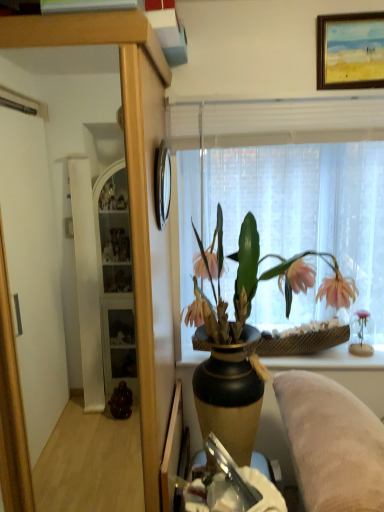
What are the coordinates of `matte black vase with pink flowers at center` in the screenshot? It's located at (244, 336).

In order to face wooden clock at upper center, which is counted as the 2th picture frame, starting from the right, should I rotate leftwards or rightwards?

A 3.665 degree turn to the left will do.

What do you see at coordinates (302, 342) in the screenshot? The image size is (384, 512). I see `woven brown basket at right` at bounding box center [302, 342].

I want to click on matte black vase with pink flowers at center, so click(244, 336).

Does point (225, 153) come behind point (261, 345)?

No, (225, 153) is closer to viewer.

Does translucent fabric at upper center come behind woven brown basket at right?

No, translucent fabric at upper center is closer to the viewer.

Considering the sizes of objects translucent fabric at upper center and woven brown basket at right in the image provided, who is thinner, translucent fabric at upper center or woven brown basket at right?

Thinner between the two is translucent fabric at upper center.

Is woven brown basket at right at the back of translucent fabric at upper center?

No, translucent fabric at upper center's orientation is not away from woven brown basket at right.

From a real-world perspective, is matte black vase with pink flowers at center above or below wooden cabinet at center?

Clearly, from a real-world perspective, matte black vase with pink flowers at center is above wooden cabinet at center.

Is matte black vase with pink flowers at center closer to the viewer compared to wooden cabinet at center?

No, matte black vase with pink flowers at center is behind wooden cabinet at center.

Considering the sizes of objects matte black vase with pink flowers at center and wooden cabinet at center in the image provided, who is shorter, matte black vase with pink flowers at center or wooden cabinet at center?

Standing shorter between the two is matte black vase with pink flowers at center.

Which point is more forward, (210, 415) or (147, 473)?

The point (210, 415) is closer to the camera.

The image size is (384, 512). Identify the location of basket that appears below the translucent fabric at upper center (from a real-world perspective). [302, 342].

Based on the photo, from a real-world perspective, is woven brown basket at right beneath translucent fabric at upper center?

Correct, in the physical world, woven brown basket at right is lower than translucent fabric at upper center.

Looking at the image, does woven brown basket at right seem bigger or smaller compared to translucent fabric at upper center?

Clearly, woven brown basket at right is smaller in size than translucent fabric at upper center.

Does translucent fabric at upper center have a larger size compared to wooden cabinet at center?

No, translucent fabric at upper center is not bigger than wooden cabinet at center.

Is translucent fabric at upper center closer to camera compared to wooden cabinet at center?

No, translucent fabric at upper center is further to the viewer.

From a real-world perspective, is translucent fabric at upper center on wooden cabinet at center?

Yes, from a real-world perspective, translucent fabric at upper center is on top of wooden cabinet at center.

Can you confirm if woven brown basket at right is smaller than matte black vase with pink flowers at center?

Yes, woven brown basket at right is smaller than matte black vase with pink flowers at center.

Would you say woven brown basket at right is a long distance from matte black vase with pink flowers at center?

That's not correct — woven brown basket at right is a little close to matte black vase with pink flowers at center.

Find the location of a particular element. This screenshot has width=384, height=512. basket that appears below the matte black vase with pink flowers at center (from a real-world perspective) is located at coordinates (302, 342).

Between woven brown basket at right and matte black vase with pink flowers at center, which one has larger width?

matte black vase with pink flowers at center.

Visually, is wooden cabinet at center positioned to the left or to the right of translucent fabric at upper center?

In the image, wooden cabinet at center appears on the left side of translucent fabric at upper center.

Is wooden cabinet at center located outside translucent fabric at upper center?

wooden cabinet at center is positioned outside translucent fabric at upper center.

Considering the sizes of objects wooden cabinet at center and translucent fabric at upper center in the image provided, who is bigger, wooden cabinet at center or translucent fabric at upper center?

Bigger between the two is wooden cabinet at center.

Measure the distance between wooden cabinet at center and translucent fabric at upper center.

wooden cabinet at center and translucent fabric at upper center are 21.73 inches apart from each other.

Is woven brown basket at right at the back of matte black vase with pink flowers at center?

No, matte black vase with pink flowers at center's orientation is not away from woven brown basket at right.

In the scene shown: Which is nearer, (334, 260) or (302, 353)?

The point (334, 260) is in front.

Who is shorter, matte black vase with pink flowers at center or woven brown basket at right?

Standing shorter between the two is woven brown basket at right.

Identify the location of basket below the translucent fabric at upper center (from a real-world perspective). (302, 342).

You are a GUI agent. You are given a task and a screenshot of the screen. Output one action in this format:
    pyautogui.click(x=<x>, y=<y>)
    Task: Click on the houseplant above the wooden cabinet at center (from the image's perspective)
    This screenshot has height=512, width=384.
    Given the screenshot: What is the action you would take?
    pyautogui.click(x=244, y=336)

Based on their spatial positions, is woven brown basket at right or wooden-framed painting at upper center, the 1th picture frame in the top-to-bottom sequence, further from wooden clock at upper center, which is counted as the 2th picture frame, starting from the right?

woven brown basket at right is positioned further to the anchor wooden clock at upper center, which is counted as the 2th picture frame, starting from the right.

From the image, which object appears to be nearer to wooden-framed painting at upper center, the second picture frame when ordered from bottom to top, woven brown basket at right or wooden clock at upper center, which is the 2th picture frame from top to bottom?

wooden clock at upper center, which is the 2th picture frame from top to bottom, is closer to wooden-framed painting at upper center, the second picture frame when ordered from bottom to top.

Which object lies further to the anchor point wooden cabinet at center, woven brown basket at right or wooden-framed painting at upper center, which is the first picture frame in right-to-left order?

Based on the image, wooden-framed painting at upper center, which is the first picture frame in right-to-left order, appears to be further to wooden cabinet at center.

Looking at the image, which one is located closer to wooden-framed painting at upper center, which is the first picture frame in right-to-left order, woven brown basket at right or wooden cabinet at center?

wooden cabinet at center is positioned closer to the anchor wooden-framed painting at upper center, which is the first picture frame in right-to-left order.

When comparing their distances from translucent fabric at upper center, does woven brown basket at right or wooden clock at upper center, the 1th picture frame in the bottom-to-top sequence, seem further?

Among the two, woven brown basket at right is located further to translucent fabric at upper center.

When comparing their distances from wooden clock at upper center, the first picture frame viewed from the left, does translucent fabric at upper center or wooden-framed painting at upper center, the 1th picture frame in the top-to-bottom sequence, seem closer?

translucent fabric at upper center is positioned closer to the anchor wooden clock at upper center, the first picture frame viewed from the left.

Looking at the image, which one is located closer to wooden-framed painting at upper center, the 1th picture frame in the top-to-bottom sequence, wooden clock at upper center, which is the 2th picture frame from top to bottom, or translucent fabric at upper center?

Based on the image, translucent fabric at upper center appears to be nearer to wooden-framed painting at upper center, the 1th picture frame in the top-to-bottom sequence.

Estimate the real-world distances between objects in this image. Which object is closer to woven brown basket at right, wooden cabinet at center or wooden clock at upper center, which is the 2th picture frame from top to bottom?

wooden cabinet at center is positioned closer to the anchor woven brown basket at right.

The height and width of the screenshot is (512, 384). Find the location of `houseplant between wooden cabinet at center and woven brown basket at right`. houseplant between wooden cabinet at center and woven brown basket at right is located at coordinates (244, 336).

Locate an element on the screen. The height and width of the screenshot is (512, 384). window between wooden-framed painting at upper center, the 2th picture frame viewed from the left, and woven brown basket at right vertically is located at coordinates (286, 168).

Image resolution: width=384 pixels, height=512 pixels. Find the location of `window between wooden cabinet at center and woven brown basket at right from left to right`. window between wooden cabinet at center and woven brown basket at right from left to right is located at coordinates (286, 168).

Where is `picture frame between wooden cabinet at center and woven brown basket at right in the horizontal direction`? This screenshot has height=512, width=384. picture frame between wooden cabinet at center and woven brown basket at right in the horizontal direction is located at coordinates (162, 184).